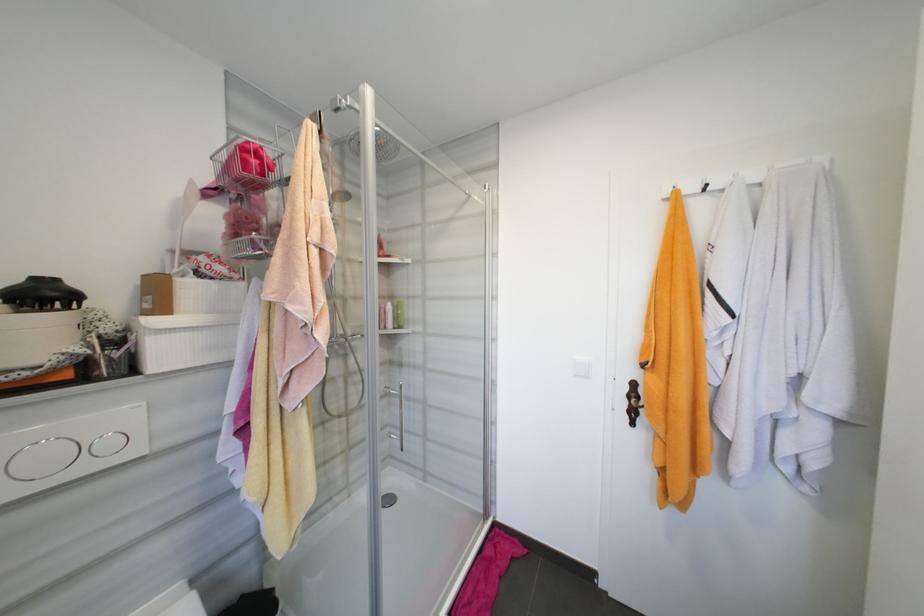
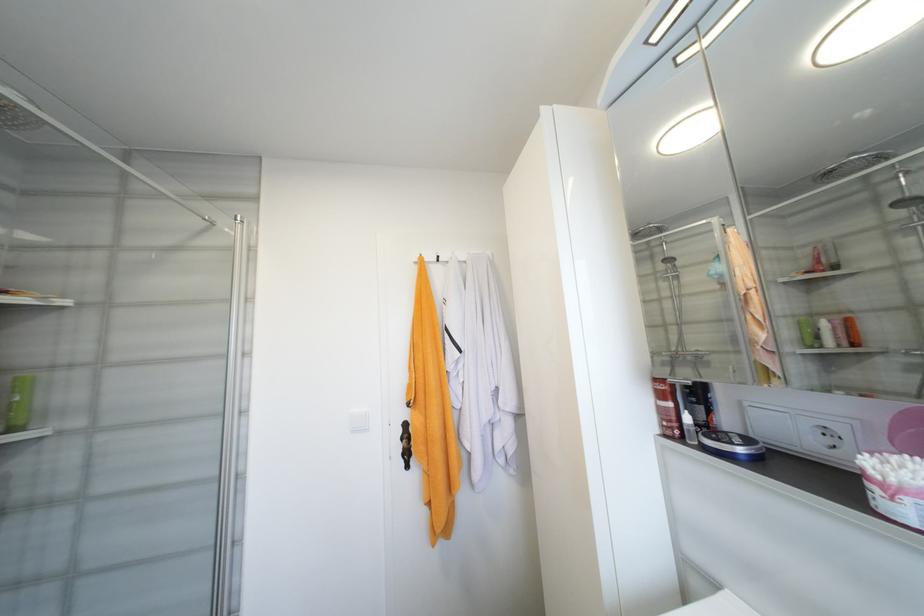
Find the pixel in the second image that matches the point at 406,328 in the first image.

(19, 430)